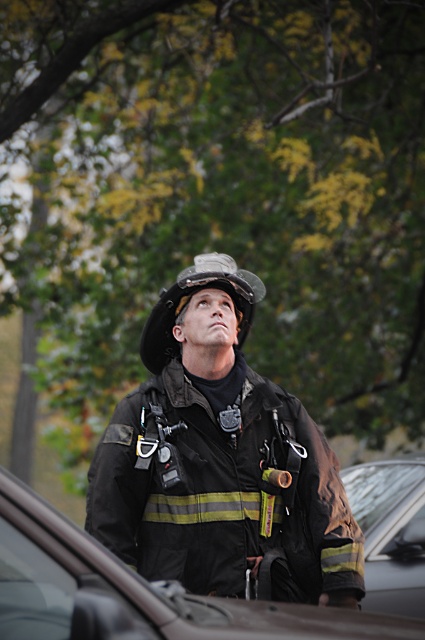
Consider the image. You are a delivery person with a package that needs to be placed exactly 3 meters away from the transparent glass car window at lower left. The black matte uniform at center is currently at the location where you want to place the package. Can you place the package at the desired location?

The distance between the black matte uniform at center and the transparent glass car window at lower left is 2.83 meters. Since the required distance is 3 meters, the package cannot be placed at the desired location as it is 0.17 meters too close.

You are a firefighter looking at the scene. Where is the black glossy car at center positioned relative to your viewpoint?

The black glossy car at center is positioned at coordinates point [136,593], which places it near the center of the scene slightly to the right and lower middle area from your viewpoint.